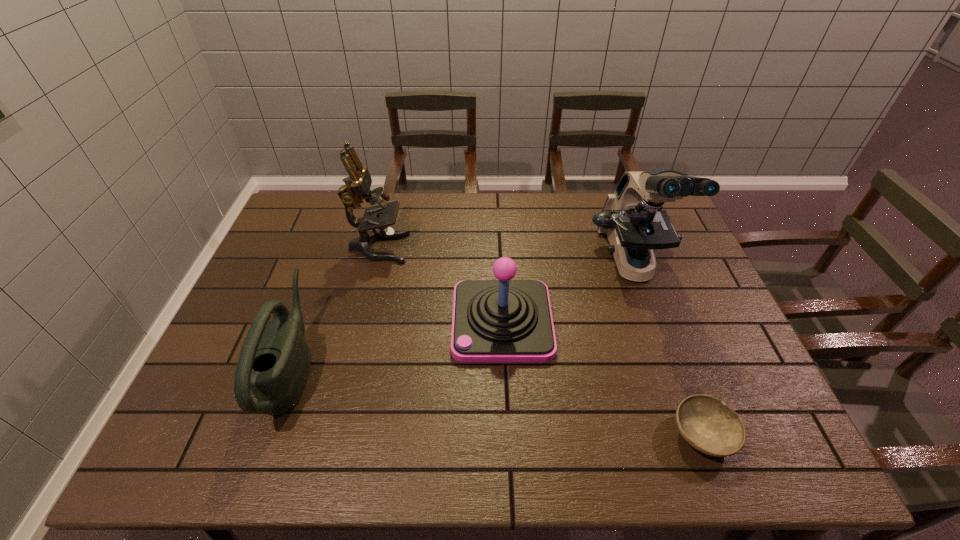
Locate an element on the screen. The height and width of the screenshot is (540, 960). free space located on the spout of the watering can is located at coordinates (352, 367).

You are a GUI agent. You are given a task and a screenshot of the screen. Output one action in this format:
    pyautogui.click(x=<x>, y=<y>)
    Task: Click on the free space located on the left of the shortest object
    Image resolution: width=960 pixels, height=540 pixels.
    Given the screenshot: What is the action you would take?
    pyautogui.click(x=562, y=434)

Identify the location of watering can that is at the near edge. The width and height of the screenshot is (960, 540). (274, 361).

Locate an element on the screen. The height and width of the screenshot is (540, 960). bowl that is at the near edge is located at coordinates (710, 426).

Where is `object at the left edge`? This screenshot has width=960, height=540. object at the left edge is located at coordinates pos(274,361).

In order to click on microscope present at the right edge in this screenshot , I will do `click(633, 219)`.

At what (x,y) coordinates should I click in order to perform the action: click on bowl situated at the right edge. Please return your answer as a coordinate pair (x, y). The height and width of the screenshot is (540, 960). Looking at the image, I should click on (710, 426).

This screenshot has height=540, width=960. Find the location of `object that is at the near left corner`. object that is at the near left corner is located at coordinates (274, 361).

At what (x,y) coordinates should I click in order to perform the action: click on object at the far right corner. Please return your answer as a coordinate pair (x, y). Looking at the image, I should click on click(x=633, y=219).

Identify the location of object that is at the near right corner. (710, 426).